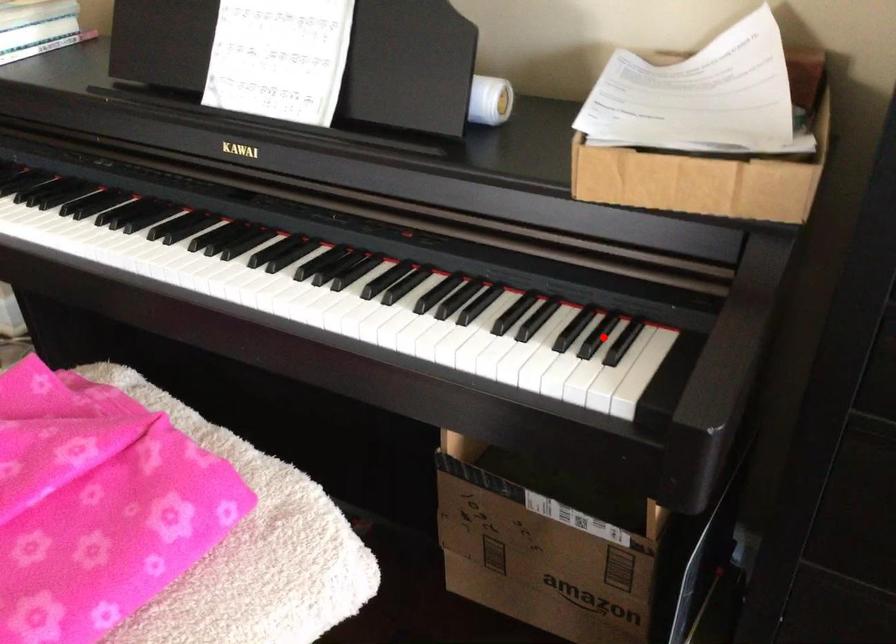
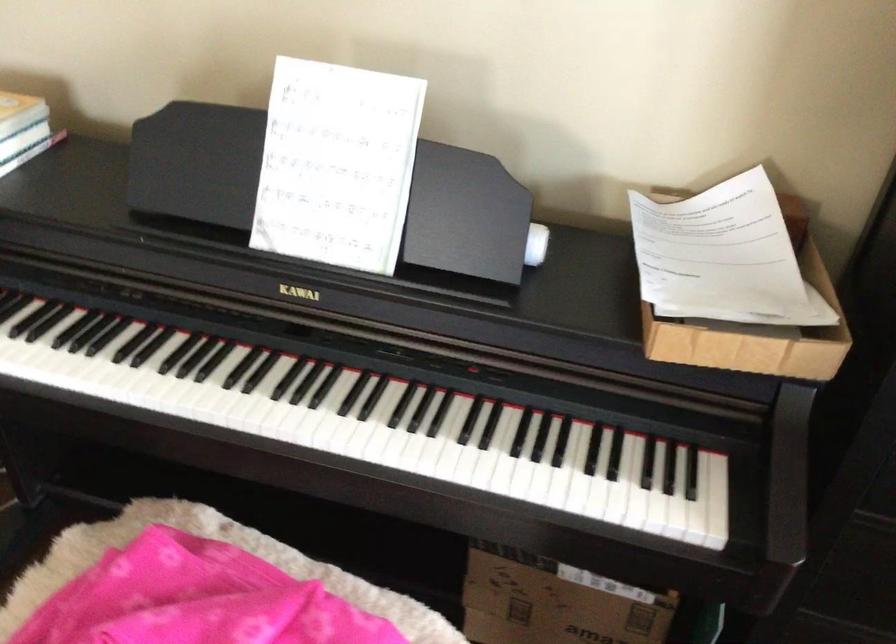
Question: I am providing you with two images of the same scene from different viewpoints. In image1, a red point is highlighted. Considering the same 3D point in image2, which of the following is correct?

Choices:
 (A) It is closer
 (B) It is farther

Answer: (B)